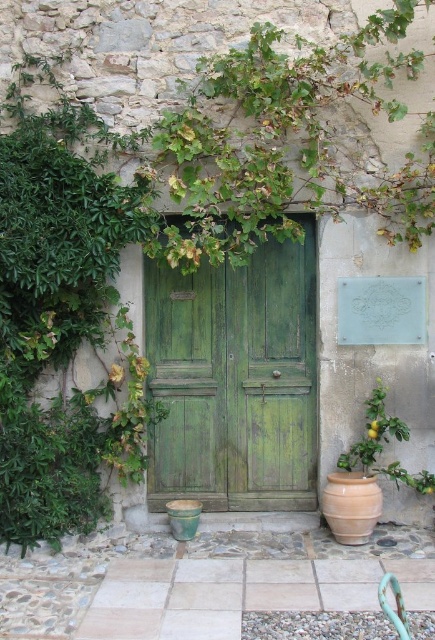
Is green wooden door at center bigger than green matte plant at lower right?

Correct, green wooden door at center is larger in size than green matte plant at lower right.

Which is below, green wooden door at center or green matte plant at lower right?

Positioned lower is green matte plant at lower right.

What do you see at coordinates (234, 380) in the screenshot? I see `green wooden door at center` at bounding box center [234, 380].

Where is `green wooden door at center`? green wooden door at center is located at coordinates (234, 380).